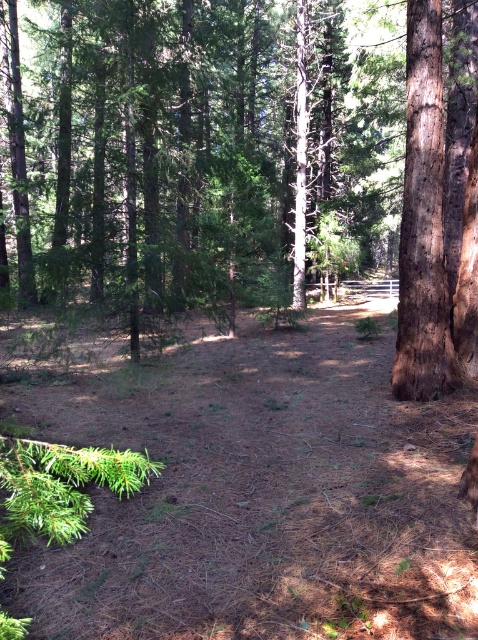
You are a hiker who wants to take a photo of both the brown textured tree at center and the brown rough bark tree at right. Since you have a camera with a limited zoom, which tree should you stand closer to in order to capture both in the same frame?

The brown textured tree at center is much taller than the brown rough bark tree at right, so you should stand closer to the taller brown textured tree at center to include both in the frame.

You are navigating through the forest and see two points marked on your map. The first point is at coordinate point [274,179] and the second point is at coordinate point [411,333]. If you are facing north, which point is closer to you?

Point [411,333] is closer to you because it is in front of point [274,179] when facing north.